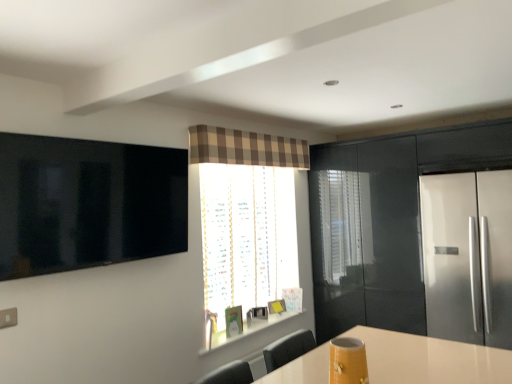
The image size is (512, 384). Describe the element at coordinates (246, 148) in the screenshot. I see `brown plaid curtain at upper center` at that location.

What do you see at coordinates (468, 256) in the screenshot? I see `satin silver fridge at right` at bounding box center [468, 256].

At what (x,y) coordinates should I click in order to perform the action: click on translucent fabric window at center. Please return your answer as a coordinate pair (x, y). Looking at the image, I should click on (247, 222).

Is matte yellow vase at lower center taller than satin silver fridge at right?

No.

Which is more to the left, matte yellow vase at lower center or satin silver fridge at right?

From the viewer's perspective, matte yellow vase at lower center appears more on the left side.

From the image's perspective, which is below, matte yellow vase at lower center or satin silver fridge at right?

matte yellow vase at lower center, from the image's perspective.

From a real-world perspective, is matte yellow vase at lower center physically located above or below satin silver fridge at right?

matte yellow vase at lower center is situated lower than satin silver fridge at right in the real world.

Does point (279, 317) lie behind point (447, 295)?

Yes, it is behind point (447, 295).

You are a GUI agent. You are given a task and a screenshot of the screen. Output one action in this format:
    pyautogui.click(x=<x>, y=<y>)
    Task: Click on the fridge below the translucent fabric window at center (from a real-world perspective)
    The image size is (512, 384).
    Given the screenshot: What is the action you would take?
    pyautogui.click(x=468, y=256)

Is translucent fabric window at center next to brown plaid curtain at upper center and touching it?

They are not placed beside each other.

Considering the sizes of objects translucent fabric window at center and brown plaid curtain at upper center in the image provided, who is smaller, translucent fabric window at center or brown plaid curtain at upper center?

With smaller size is brown plaid curtain at upper center.

Can you confirm if translucent fabric window at center is taller than brown plaid curtain at upper center?

Correct, translucent fabric window at center is much taller as brown plaid curtain at upper center.

What's the angular difference between glossy black cabinet at right and satin silver fridge at right's facing directions?

The facing directions of glossy black cabinet at right and satin silver fridge at right are 0.459 degrees apart.

Which point is more distant from viewer, [489,140] or [509,330]?

Point [489,140]

Which is in front, glossy black cabinet at right or satin silver fridge at right?

satin silver fridge at right is more forward.

Considering the points (225, 130) and (241, 209), which point is behind, point (225, 130) or point (241, 209)?

The point (241, 209) is farther.

Is brown plaid curtain at upper center positioned in front of translucent fabric window at center?

Yes.

Based on their sizes in the image, would you say brown plaid curtain at upper center is bigger or smaller than translucent fabric window at center?

Clearly, brown plaid curtain at upper center is smaller in size than translucent fabric window at center.

Would you say brown plaid curtain at upper center is a long distance from translucent fabric window at center?

No.

Is matte yellow vase at lower center situated inside translucent fabric window at center or outside?

matte yellow vase at lower center is located beyond the bounds of translucent fabric window at center.

Considering the relative sizes of matte yellow vase at lower center and translucent fabric window at center in the image provided, is matte yellow vase at lower center shorter than translucent fabric window at center?

Correct, matte yellow vase at lower center is not as tall as translucent fabric window at center.

From the image's perspective, does matte yellow vase at lower center appear higher than translucent fabric window at center?

No.

Is translucent fabric window at center at the back of matte yellow vase at lower center?

matte yellow vase at lower center does not have its back to translucent fabric window at center.

Between brown plaid curtain at upper center and satin silver fridge at right, which one has larger size?

satin silver fridge at right.

Is brown plaid curtain at upper center at the right side of satin silver fridge at right?

No.

From the image's perspective, which one is positioned lower, brown plaid curtain at upper center or satin silver fridge at right?

From the image's view, satin silver fridge at right is below.

What are the coordinates of `appliance below the satin silver fridge at right (from a real-world perspective)` in the screenshot? It's located at (348, 361).

Locate an element on the screen. The width and height of the screenshot is (512, 384). window above the satin silver fridge at right (from a real-world perspective) is located at coordinates (247, 222).

From the image, which object appears to be farther from brown plaid curtain at upper center, satin silver fridge at right or matte yellow vase at lower center?

The object further to brown plaid curtain at upper center is matte yellow vase at lower center.

Estimate the real-world distances between objects in this image. Which object is closer to matte yellow vase at lower center, brown plaid curtain at upper center or satin silver fridge at right?

brown plaid curtain at upper center is closer to matte yellow vase at lower center.

Looking at the image, which one is located closer to translucent fabric window at center, brown plaid curtain at upper center or matte yellow vase at lower center?

brown plaid curtain at upper center lies closer to translucent fabric window at center than the other object.

Which object lies further to the anchor point matte yellow vase at lower center, translucent fabric window at center or satin silver fridge at right?

Based on the image, translucent fabric window at center appears to be further to matte yellow vase at lower center.

Looking at this image, estimate the real-world distances between objects in this image. Which object is closer to brown plaid curtain at upper center, translucent fabric window at center or glossy black cabinet at right?

translucent fabric window at center is closer to brown plaid curtain at upper center.

Looking at the image, which one is located closer to brown plaid curtain at upper center, matte yellow vase at lower center or satin silver fridge at right?

Based on the image, satin silver fridge at right appears to be nearer to brown plaid curtain at upper center.

Consider the image. Estimate the real-world distances between objects in this image. Which object is closer to brown plaid curtain at upper center, matte yellow vase at lower center or glossy black cabinet at right?

Based on the image, glossy black cabinet at right appears to be nearer to brown plaid curtain at upper center.

From the image, which object appears to be nearer to brown plaid curtain at upper center, translucent fabric window at center or satin silver fridge at right?

translucent fabric window at center.

The height and width of the screenshot is (384, 512). Find the location of `cabinetry between translucent fabric window at center and satin silver fridge at right`. cabinetry between translucent fabric window at center and satin silver fridge at right is located at coordinates (392, 220).

The image size is (512, 384). What are the coordinates of `curtain between matte yellow vase at lower center and translucent fabric window at center in the front-back direction` in the screenshot? It's located at (246, 148).

Locate an element on the screen. appliance between brown plaid curtain at upper center and satin silver fridge at right is located at coordinates (348, 361).

Where is `appliance situated between translucent fabric window at center and satin silver fridge at right from left to right`? Image resolution: width=512 pixels, height=384 pixels. appliance situated between translucent fabric window at center and satin silver fridge at right from left to right is located at coordinates (348, 361).